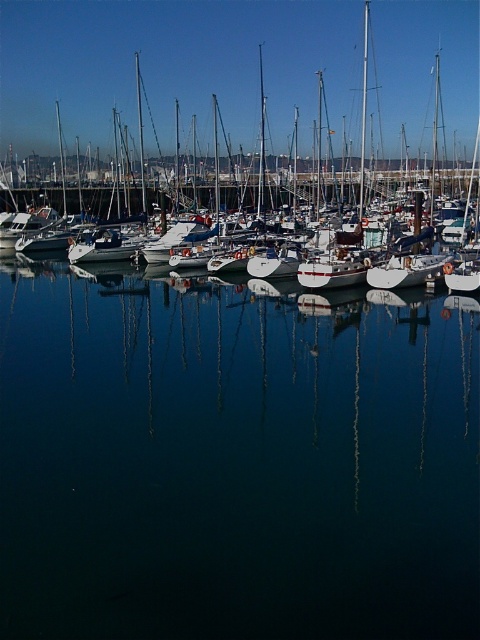
This screenshot has width=480, height=640. Describe the element at coordinates (233, 460) in the screenshot. I see `dark blue water at center` at that location.

Does point (416, 449) lie in front of point (249, 52)?

Yes, it is.

Find the location of a particular element. dark blue water at center is located at coordinates (233, 460).

Locate an element on the screen. The height and width of the screenshot is (640, 480). dark blue water at center is located at coordinates (233, 460).